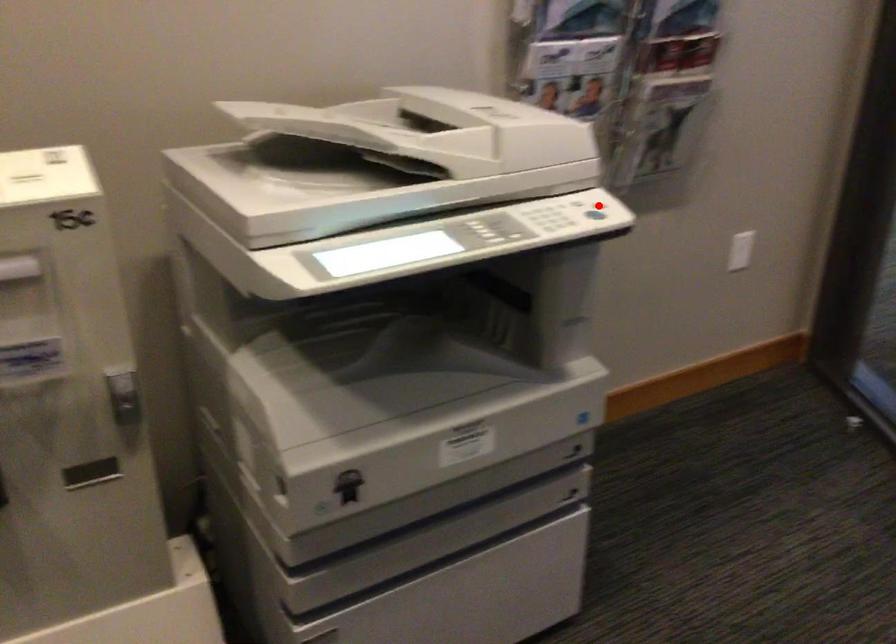
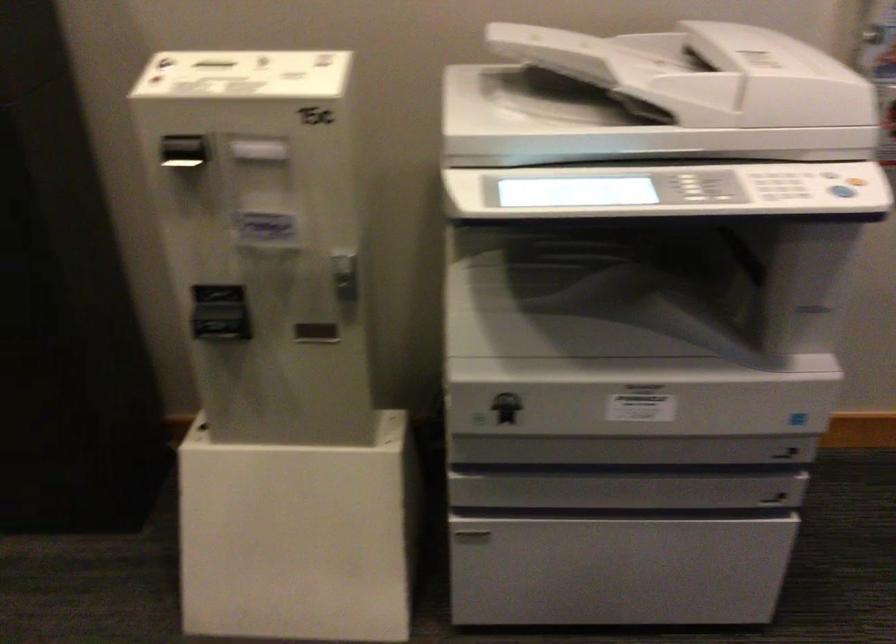
Question: I am providing you with two images of the same scene from different viewpoints. Image1 has a red point marked. In image2, the corresponding 3D location appears at what relative position? Reply with the corresponding letter.

Choices:
 (A) Closer
 (B) Farther

Answer: (A)